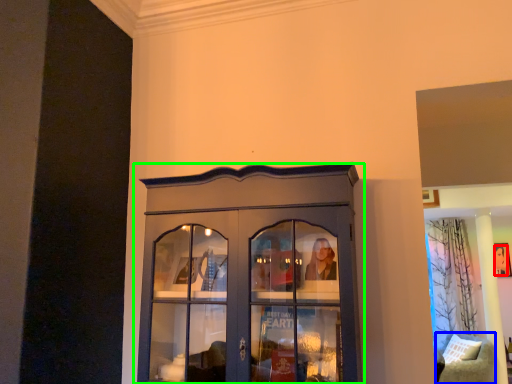
Question: Considering the real-world distances, which object is closest to person (highlighted by a red box)? furniture (highlighted by a blue box) or cupboard (highlighted by a green box).

Choices:
 (A) furniture
 (B) cupboard

Answer: (A)